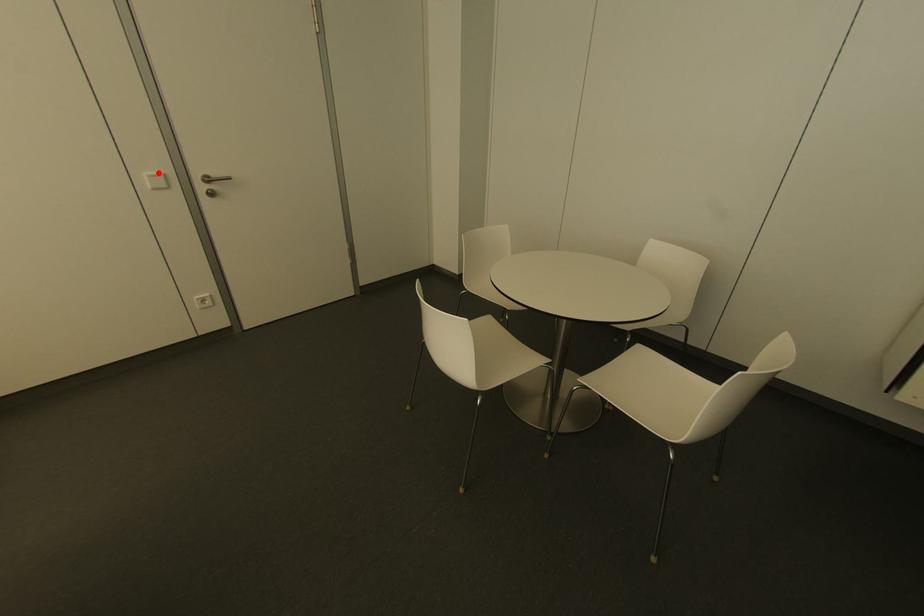
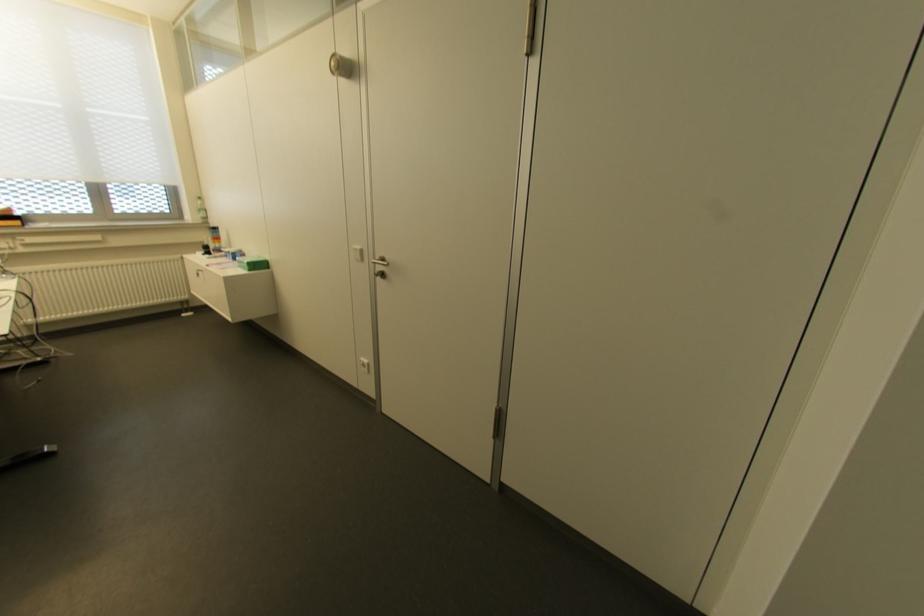
Locate, in the second image, the point that corresponds to the highlighted location in the first image.

(358, 246)